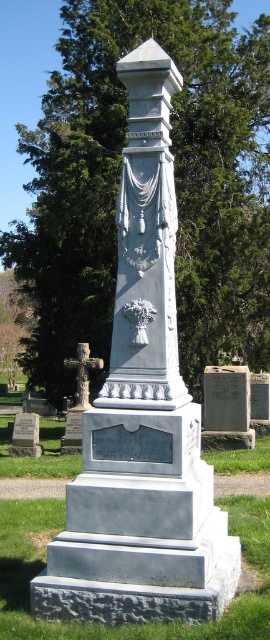
From the picture: You are standing at the viewpoint of the image and want to know if the point at coordinates point (129, 35) is closer to you than point (163, 246). Can you determine this?

Point (129, 35) is behind point (163, 246), so it is farther away from you.

You are an architect designing a new cemetery layout. You need to place a new bench between the white marble monument at center and the dark gray stone cross at left. Which side of the monument should the bench be placed closer to, so that it doesn

The white marble monument at center is thinner than the dark gray stone cross at left. Therefore, the bench should be placed closer to the white marble monument at center to ensure balance between the two structures.